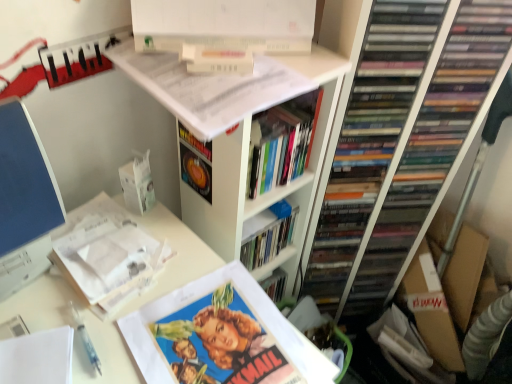
Find the location of `free location to the right of white paper at upper left, positioned as the 2th book in bottom-to-top order`. free location to the right of white paper at upper left, positioned as the 2th book in bottom-to-top order is located at coordinates (170, 261).